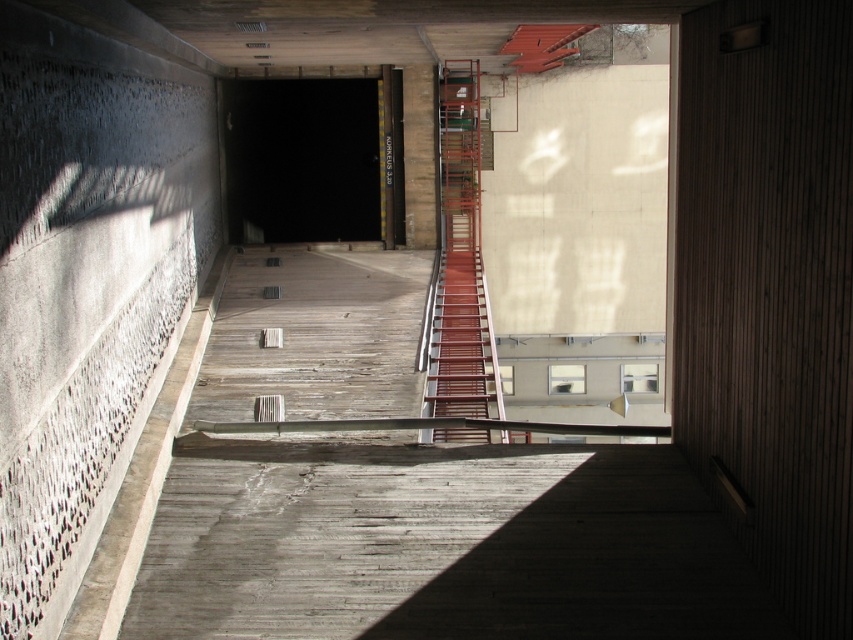
Which is behind, point (323, 216) or point (500, 394)?

The point (323, 216) is more distant.

Does black matte tunnel at center lie behind metallic red staircase at center?

That is True.

The image size is (853, 640). Find the location of `black matte tunnel at center`. black matte tunnel at center is located at coordinates (300, 160).